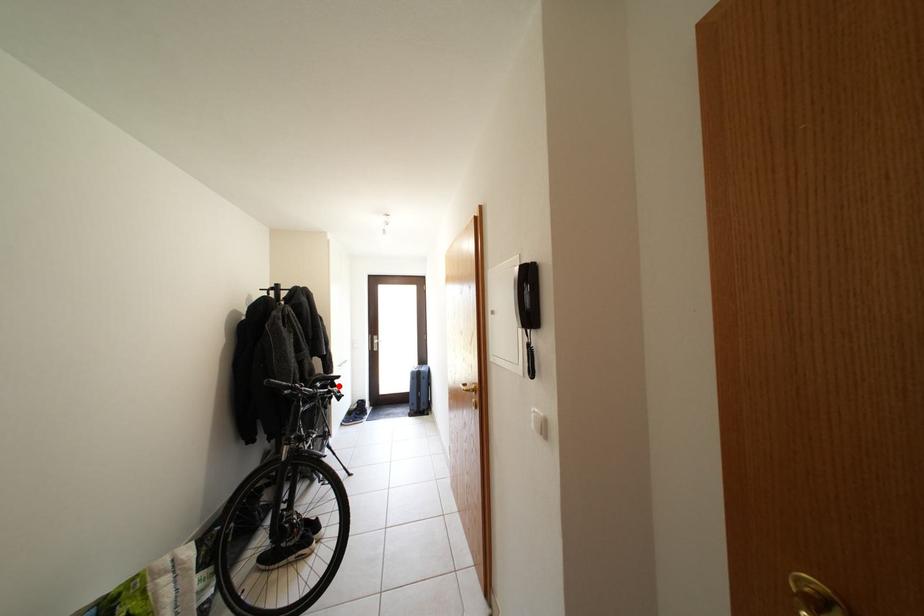
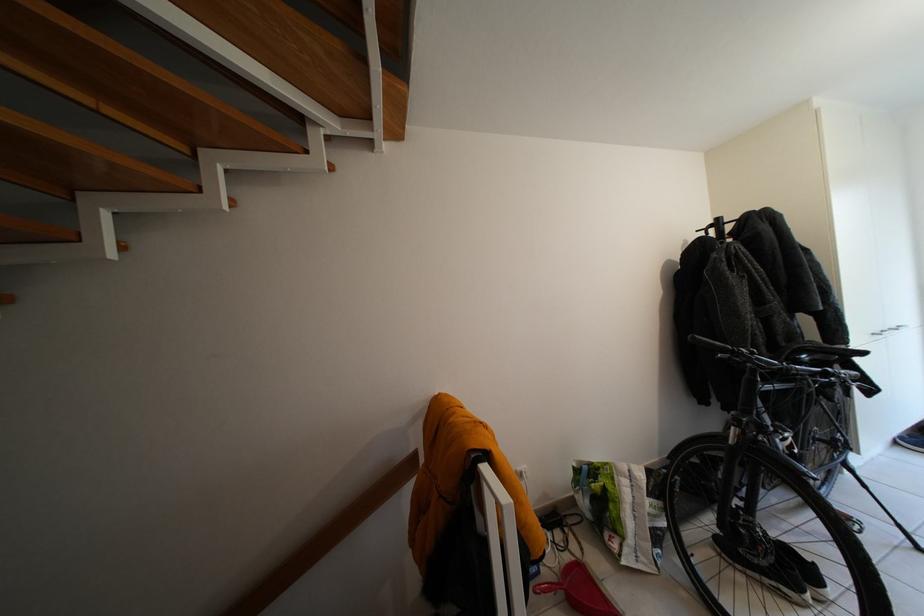
In the second image, find the point that corresponds to the highlighted location in the first image.

(846, 361)